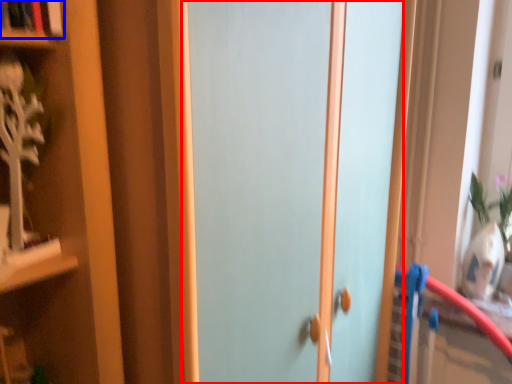
Question: Which object appears closest to the camera in this image, door (highlighted by a red box) or book (highlighted by a blue box)?

Choices:
 (A) door
 (B) book

Answer: (A)